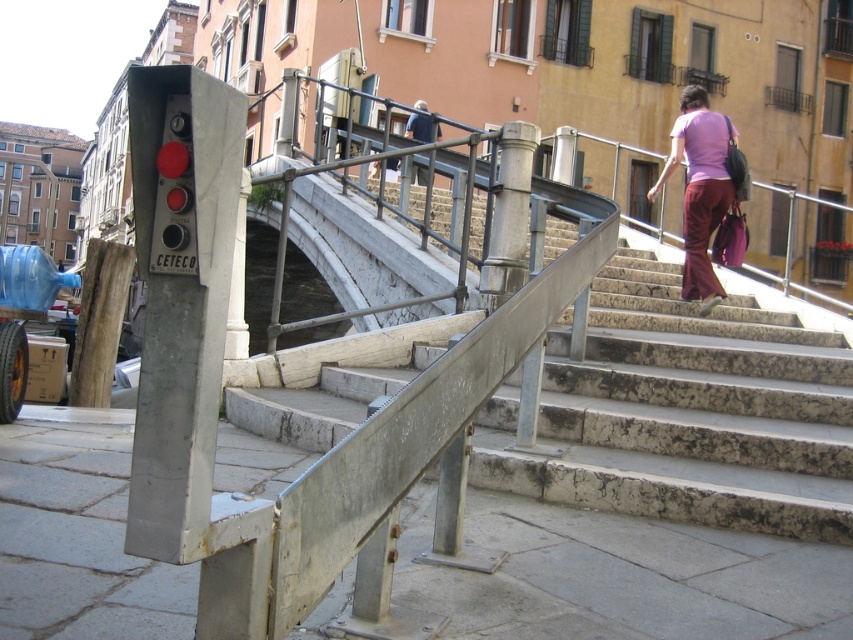
Question: Can you confirm if stone stairs at upper center is positioned to the left of pink fabric pants at upper right?

Choices:
 (A) no
 (B) yes

Answer: (B)

Question: In this image, where is stone stairs at upper center located relative to pink fabric pants at upper right?

Choices:
 (A) above
 (B) below

Answer: (B)

Question: Which object is closer to the camera taking this photo?

Choices:
 (A) stone stairs at upper center
 (B) dark blue jacket at upper center
 (C) pink fabric pants at upper right

Answer: (A)

Question: Which object appears farthest from the camera in this image?

Choices:
 (A) pink fabric pants at upper right
 (B) dark blue jacket at upper center

Answer: (B)

Question: Estimate the real-world distances between objects in this image. Which object is closer to the stone stairs at upper center?

Choices:
 (A) pink fabric pants at upper right
 (B) dark blue jacket at upper center

Answer: (A)

Question: Does stone stairs at upper center lie in front of pink fabric pants at upper right?

Choices:
 (A) no
 (B) yes

Answer: (B)